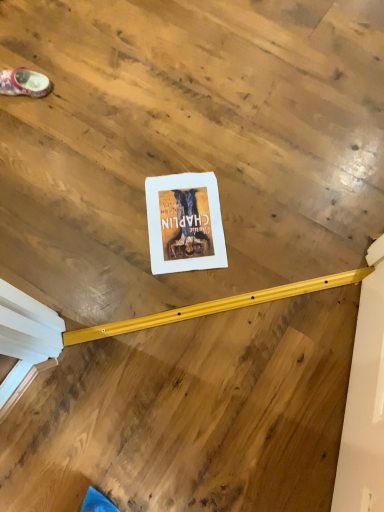
The height and width of the screenshot is (512, 384). In order to click on vacant space behind matte pink fabric slipper at upper left in this screenshot , I will do point(36,45).